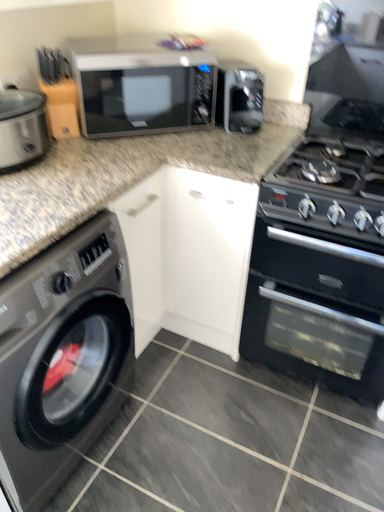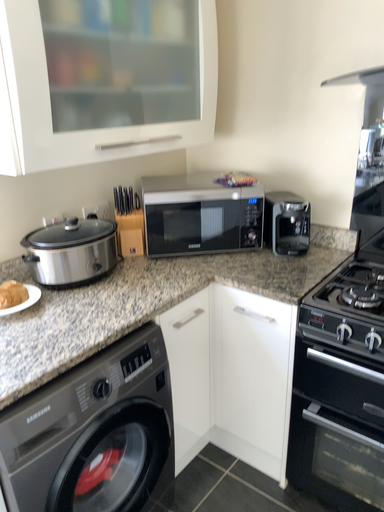
Question: How did the camera likely rotate when shooting the video?

Choices:
 (A) rotated upward
 (B) rotated downward

Answer: (A)